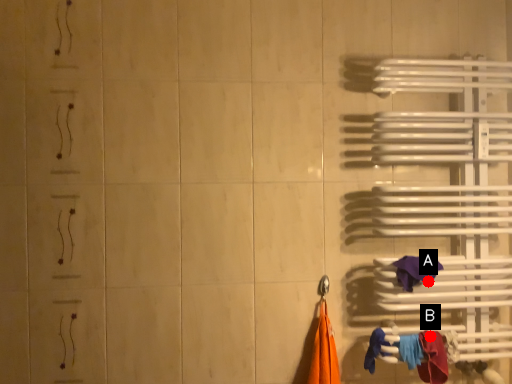
Question: Two points are circled on the image, labeled by A and B beside each circle. Which point is further to the camera?

Choices:
 (A) A is further
 (B) B is further

Answer: (A)